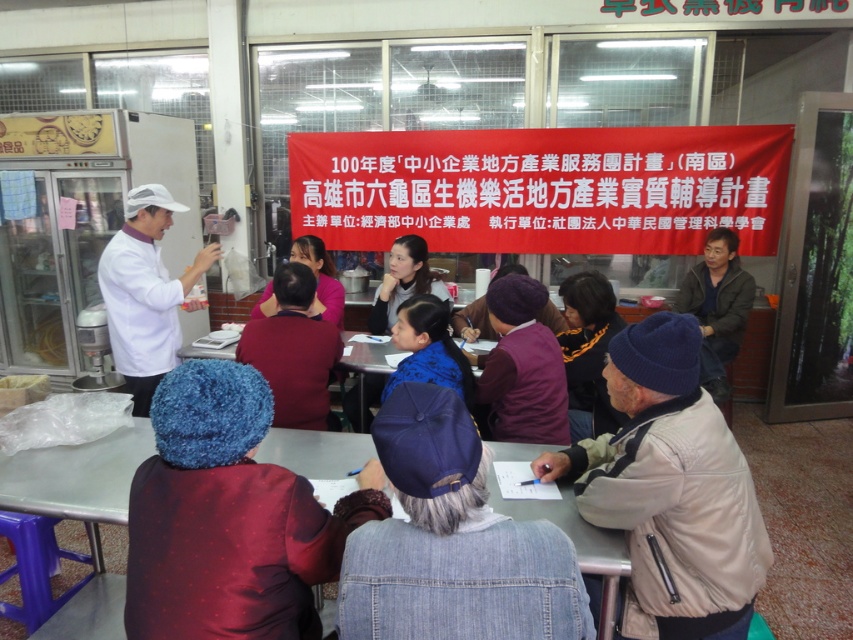
You are organizing a coat rack for the meeting attendees. The purple denim jacket at center and the dark brown leather jacket at right need to be hung side by side. If the rack has only 1.2 meters of space between two hooks, will both jackets fit without overlapping?

→ The purple denim jacket at center is wider than the dark brown leather jacket at right. Since the total space between the hooks is 1.2 meters, but the exact widths aren

You are standing in the room and want to move from the point at coordinates (x=426, y=616) to the point at coordinates (x=740, y=320). Which direction should you move relative to your current position?

You should move towards the point at coordinates (x=740, y=320) by moving away from the viewer since point (x=426, y=616) is closer to the viewer than point (x=740, y=320).